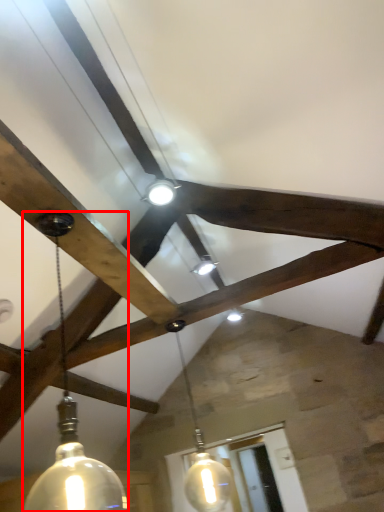
Question: From the image's perspective, where is lamp (annotated by the red box) located relative to lamp?

Choices:
 (A) below
 (B) above

Answer: (B)